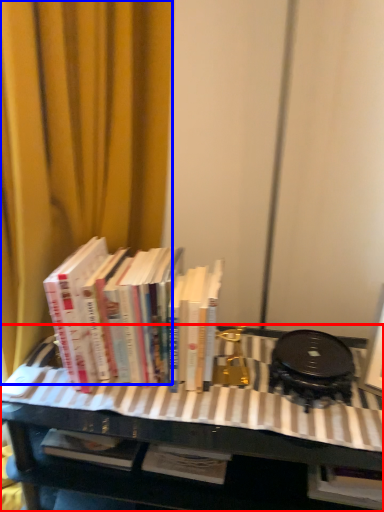
Question: Which point is further to the camera, table (highlighted by a red box) or curtain (highlighted by a blue box)?

Choices:
 (A) table
 (B) curtain

Answer: (A)